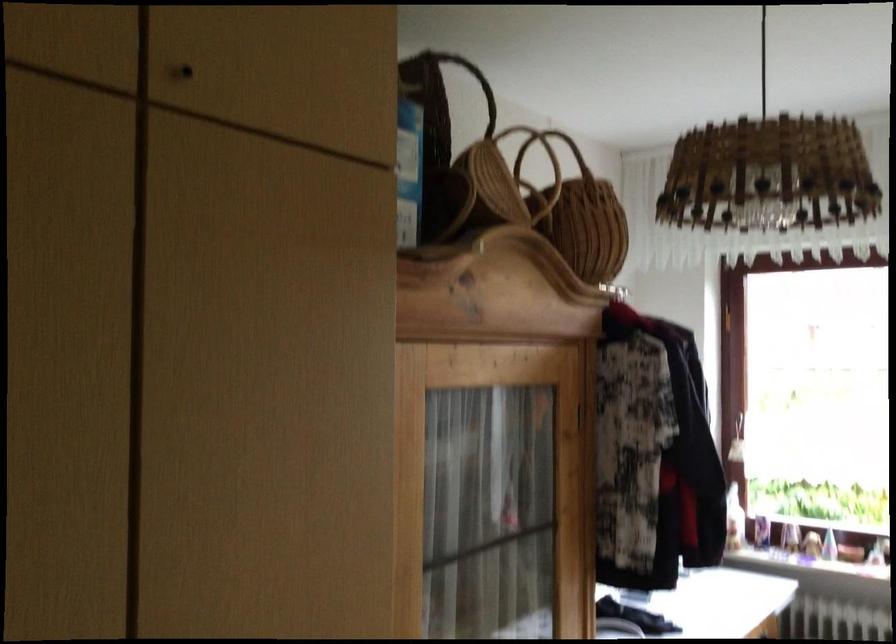
This screenshot has height=644, width=896. Describe the element at coordinates (185, 71) in the screenshot. I see `a black cabinet knob` at that location.